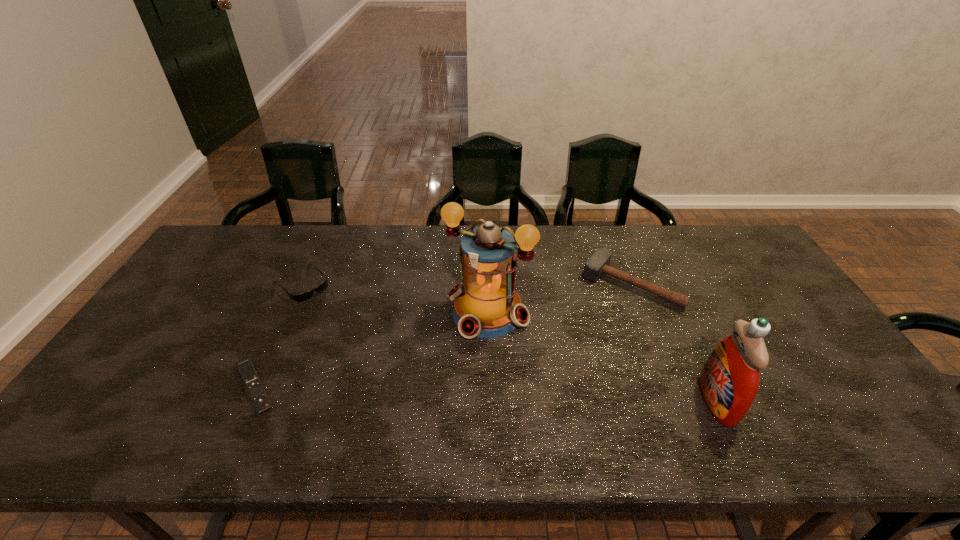
Image resolution: width=960 pixels, height=540 pixels. In order to click on vacant area situated 0.280m on the front-facing side of the sunglasses in this screenshot , I will do `click(371, 349)`.

What are the coordinates of `vacant space situated on the front-facing side of the sunglasses` in the screenshot? It's located at (342, 322).

Locate an element on the screen. The width and height of the screenshot is (960, 540). vacant area situated on the front-facing side of the sunglasses is located at coordinates (358, 337).

This screenshot has width=960, height=540. I want to click on vacant space positioned on the striking surface of the third tallest object, so click(565, 367).

In order to click on vacant position located on the striking surface of the third tallest object in this screenshot , I will do `click(561, 374)`.

You are a GUI agent. You are given a task and a screenshot of the screen. Output one action in this format:
    pyautogui.click(x=<x>, y=<y>)
    Task: Click on the free location located on the striking surface of the third tallest object
    
    Given the screenshot: What is the action you would take?
    pyautogui.click(x=595, y=328)

You are a GUI agent. You are given a task and a screenshot of the screen. Output one action in this format:
    pyautogui.click(x=<x>, y=<y>)
    Task: Click on the free space located on the front-facing side of the third object from left to right
    
    Given the screenshot: What is the action you would take?
    pyautogui.click(x=420, y=400)

I want to click on free space located on the front-facing side of the third object from left to right, so click(x=446, y=364).

Locate an element on the screen. The image size is (960, 540). vacant position located 0.110m on the front-facing side of the third object from left to right is located at coordinates click(444, 367).

At what (x,y) coordinates should I click in order to perform the action: click on sunglasses that is at the far edge. Please return your answer as a coordinate pair (x, y). The image size is (960, 540). Looking at the image, I should click on (302, 297).